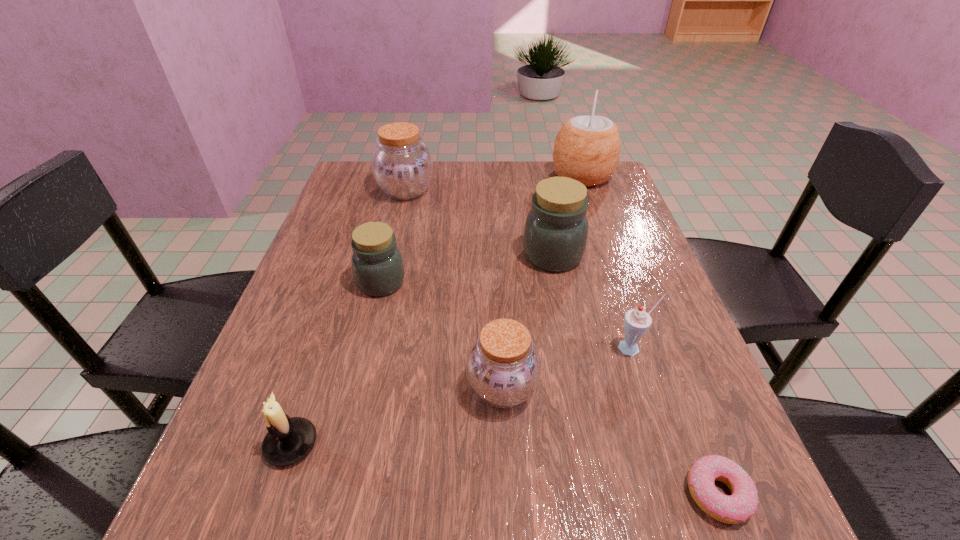
Locate an element on the screen. This screenshot has height=540, width=960. the tallest object is located at coordinates (587, 148).

Locate an element on the screen. Image resolution: width=960 pixels, height=540 pixels. the bigger brown jar is located at coordinates (402, 165).

Identify the location of the left brown jar. Image resolution: width=960 pixels, height=540 pixels. pyautogui.click(x=402, y=165).

Identify the location of the bigger green jar. (556, 229).

Image resolution: width=960 pixels, height=540 pixels. I want to click on the smaller green jar, so click(x=377, y=264).

Identify the location of the right brown jar. This screenshot has width=960, height=540. pos(503,367).

You are a GUI agent. You are given a task and a screenshot of the screen. Output one action in this format:
    pyautogui.click(x=<x>, y=<y>)
    Task: Click on the smaller brown jar
    The image size is (960, 540).
    Given the screenshot: What is the action you would take?
    pyautogui.click(x=503, y=367)

Locate an element on the screen. The height and width of the screenshot is (540, 960). the fourth nearest object is located at coordinates (636, 321).

Identify the location of white milkshake. (636, 321).

Where is `candle holder`? candle holder is located at coordinates (288, 440).